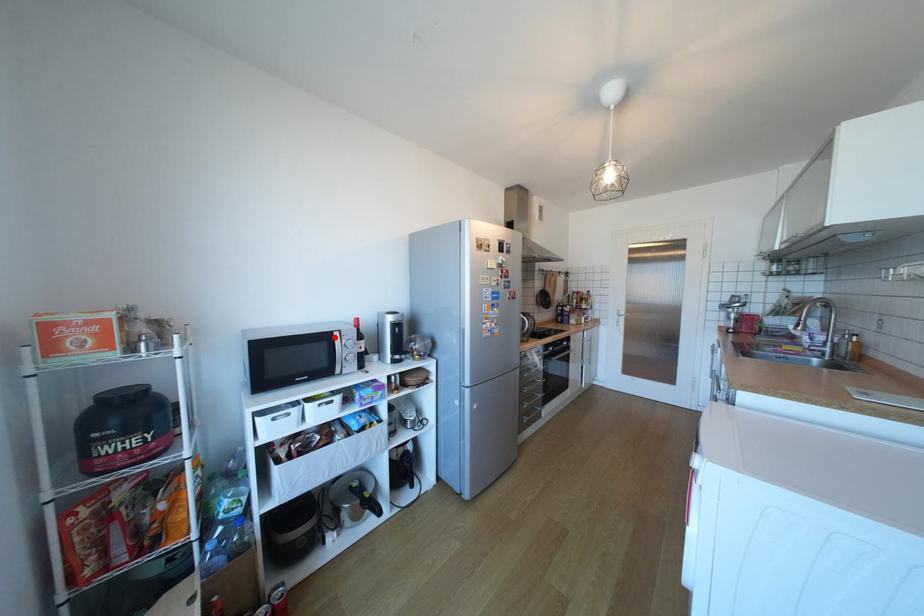
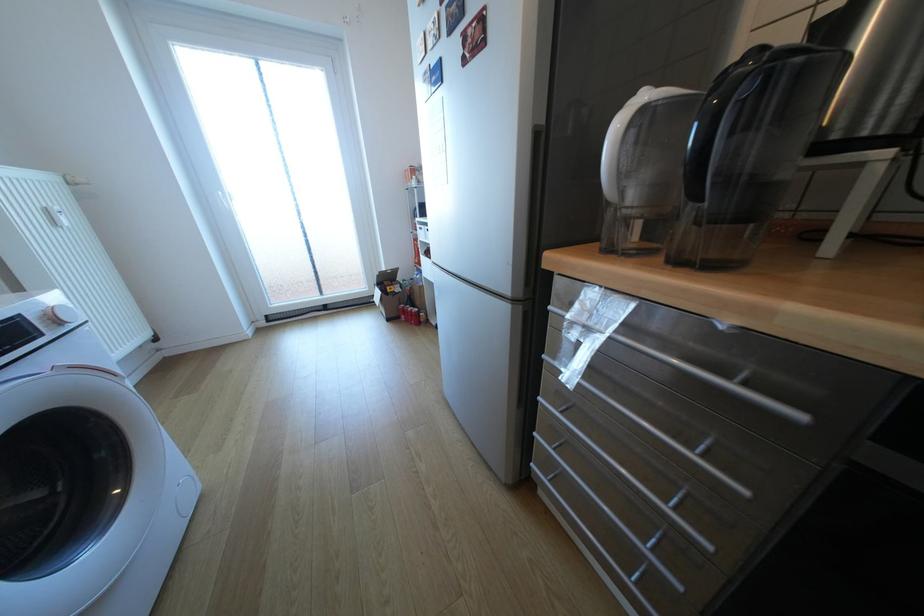
Question: I am providing you with two images of the same scene from different viewpoints. A red point is marked on the first image. At the location where the point appears in image 1, is it still visible in image 2?

Choices:
 (A) Yes
 (B) No

Answer: (B)